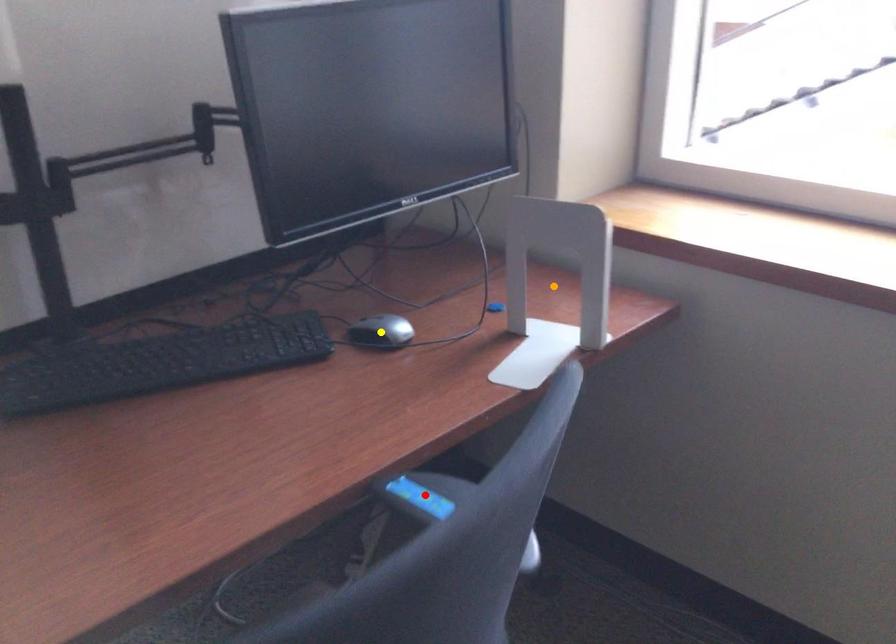
From the picture: Order these from nearest to farthest:
red point | yellow point | orange point

yellow point
orange point
red point